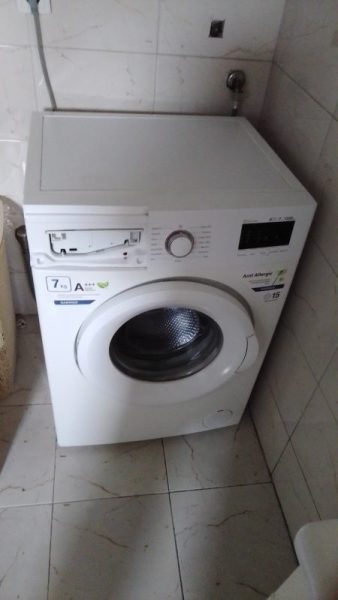
Identify the location of plug. The width and height of the screenshot is (338, 600). (31, 7).